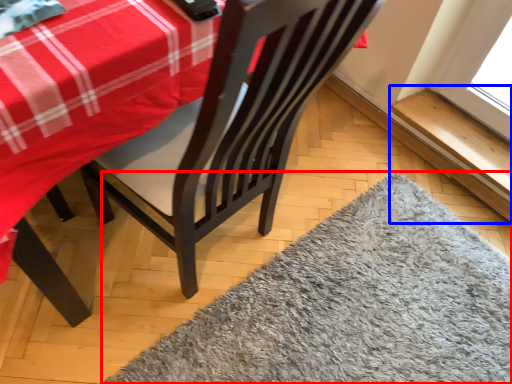
Question: Which object is closer to the camera taking this photo, mat (highlighted by a red box) or window sill (highlighted by a blue box)?

Choices:
 (A) mat
 (B) window sill

Answer: (A)